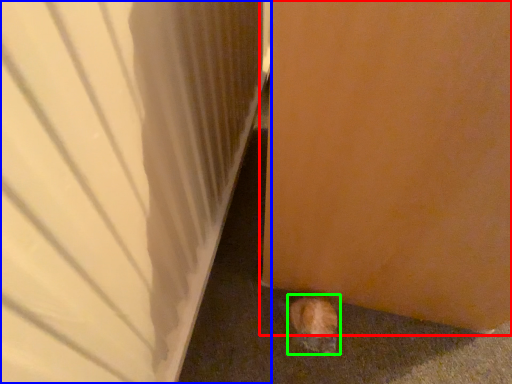
Question: Considering the real-world distances, which object is closest to door (highlighted by a red box)? door (highlighted by a blue box) or animal (highlighted by a green box).

Choices:
 (A) door
 (B) animal

Answer: (A)